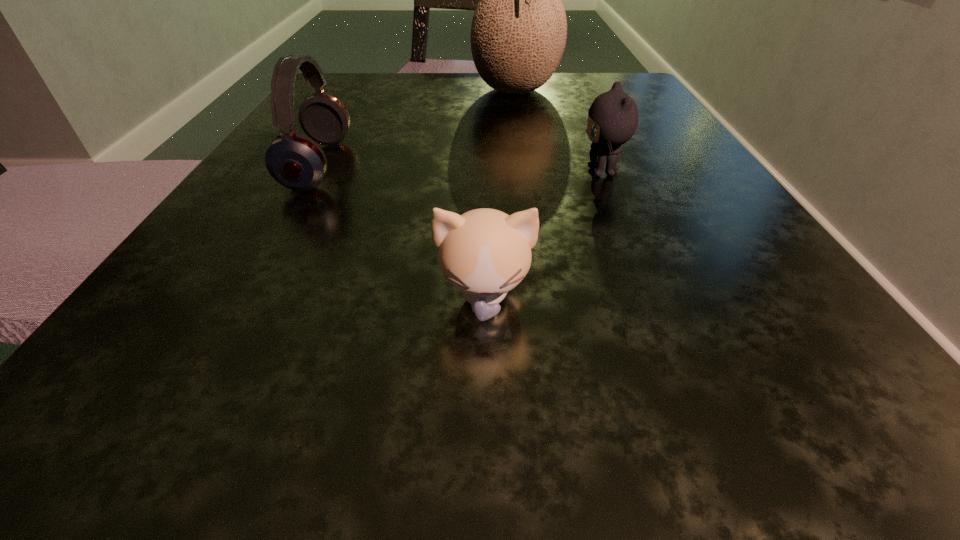
I want to click on free area in between the third shortest object and the cantaloup, so click(417, 128).

Locate an element on the screen. empty space between the left kitten and the cantaloup is located at coordinates (500, 195).

At what (x,y) coordinates should I click in order to perform the action: click on empty space that is in between the tallest object and the nearer kitten. Please return your answer as a coordinate pair (x, y). The width and height of the screenshot is (960, 540). Looking at the image, I should click on (500, 195).

Select which object is the third closest to the nearer kitten. Please provide its 2D coordinates. Your answer should be formatted as a tuple, i.e. [(x, y)], where the tuple contains the x and y coordinates of a point satisfying the conditions above.

[(518, 34)]

Choose which object is the nearest neighbor to the third shortest object. Please provide its 2D coordinates. Your answer should be formatted as a tuple, i.e. [(x, y)], where the tuple contains the x and y coordinates of a point satisfying the conditions above.

[(518, 34)]

Where is `vacant space that satisfies the following two spatial constraints: 1. on the front side of the cantaloup; 2. on the ear cups of the third shortest object`? vacant space that satisfies the following two spatial constraints: 1. on the front side of the cantaloup; 2. on the ear cups of the third shortest object is located at coordinates (528, 165).

I want to click on vacant region that satisfies the following two spatial constraints: 1. on the front-facing side of the right kitten; 2. on the face of the left kitten, so click(x=655, y=299).

Locate an element on the screen. vacant space that satisfies the following two spatial constraints: 1. on the front-facing side of the farther kitten; 2. on the face of the nearest object is located at coordinates (655, 299).

At what (x,y) coordinates should I click in order to perform the action: click on vacant area in the image that satisfies the following two spatial constraints: 1. on the front-facing side of the right kitten; 2. on the face of the nearest object. Please return your answer as a coordinate pair (x, y). The width and height of the screenshot is (960, 540). Looking at the image, I should click on (655, 299).